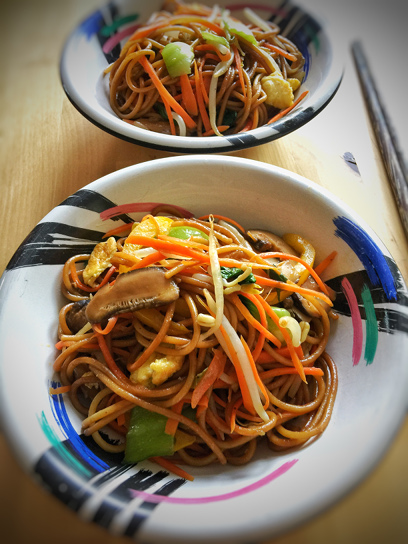
Find the location of a particular element. This screenshot has height=544, width=408. rim of bowl is located at coordinates (284, 136), (287, 170).